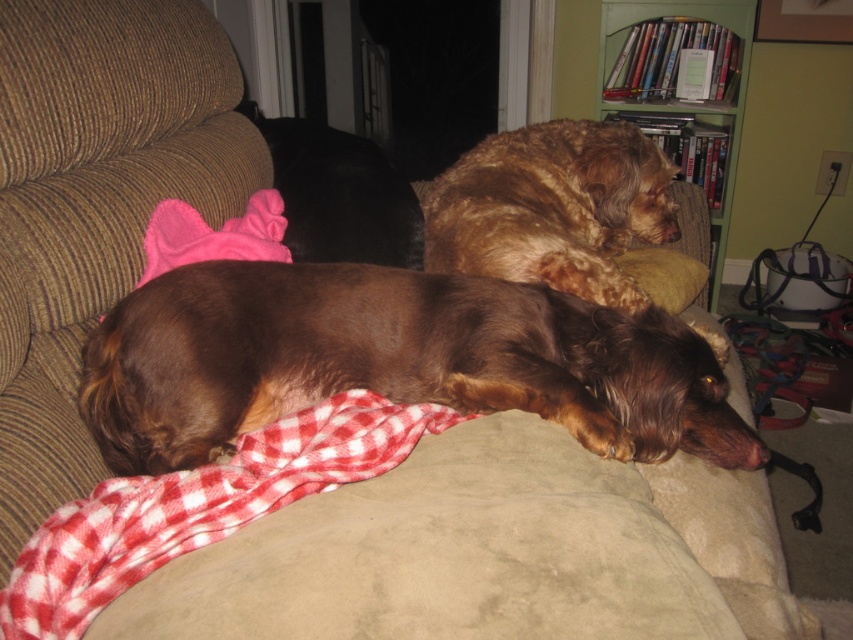
You are a photographer trying to capture both the brown shaggy dog at center and the green wood bookshelf at upper right in a single frame. Based on their sizes in the image, which object would require you to adjust your camera angle more to ensure both are fully visible?

The green wood bookshelf at upper right requires more adjustment because it occupies more space than the brown shaggy dog at center, so the photographer needs to ensure the camera angle captures its larger size without cropping it out.

You are a dog owner who wants to place a 75 cm long toy between the red checkered blanket at lower center and the golden brown fur at upper right. Will the toy fit between them?

The distance between the red checkered blanket at lower center and the golden brown fur at upper right is 74.70 centimeters. Since the toy is 75 cm long, it will not fit completely between them as the space is slightly shorter than the toy.

You are a dog owner who wants to ensure both dogs are comfortable. The red checkered blanket at lower center and the golden brown fur at upper right are visible. Which object is underneath the other?

The red checkered blanket at lower center is positioned under golden brown fur at upper right, so the blanket is underneath the golden brown fur at upper right.